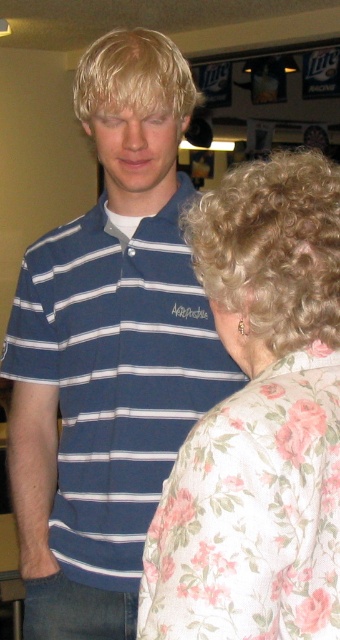
You are a photographer setting up for a group photo. You need to position two people so that there is at least 18 inches between them. Given the current positions of the blue striped polo shirt at center and the floral fabric blouse at right, will they need to move further apart to meet the requirement?

The distance between the blue striped polo shirt at center and the floral fabric blouse at right is 17.44 inches, which is less than the required 18 inches. Therefore, they need to move further apart to meet the requirement.

You are at a bar and need to find the person wearing the floral fabric blouse at right. Which direction should you look from the blue striped polo shirt at center?

The blue striped polo shirt at center is to the left of the floral fabric blouse at right, so you should look to your right from the blue striped polo shirt at center to find the floral fabric blouse at right.

You are a photographer setting up for a group photo. You notice the blue striped polo shirt at center and the floral fabric blouse at right. Which clothing item is covering part of the other?

The blue striped polo shirt at center is positioned over the floral fabric blouse at right, meaning it is covering part of it.